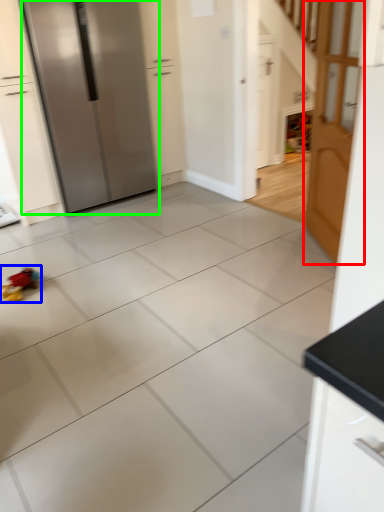
Question: Which object is positioned farthest from door (highlighted by a red box)? Select from toy (highlighted by a blue box) and refrigerator (highlighted by a green box).

Choices:
 (A) toy
 (B) refrigerator

Answer: (A)